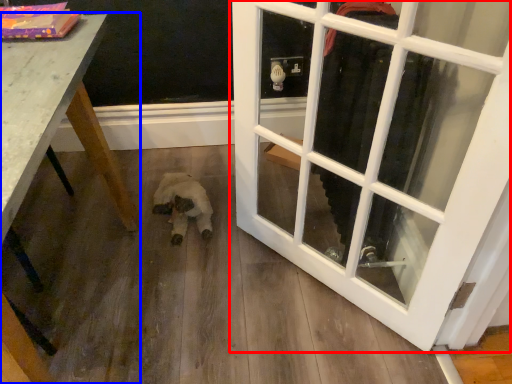
Question: Which of the following is the farthest to the observer, door (highlighted by a red box) or table (highlighted by a blue box)?

Choices:
 (A) door
 (B) table

Answer: (A)